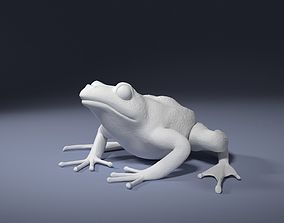
I want to click on light, so click(x=63, y=186).